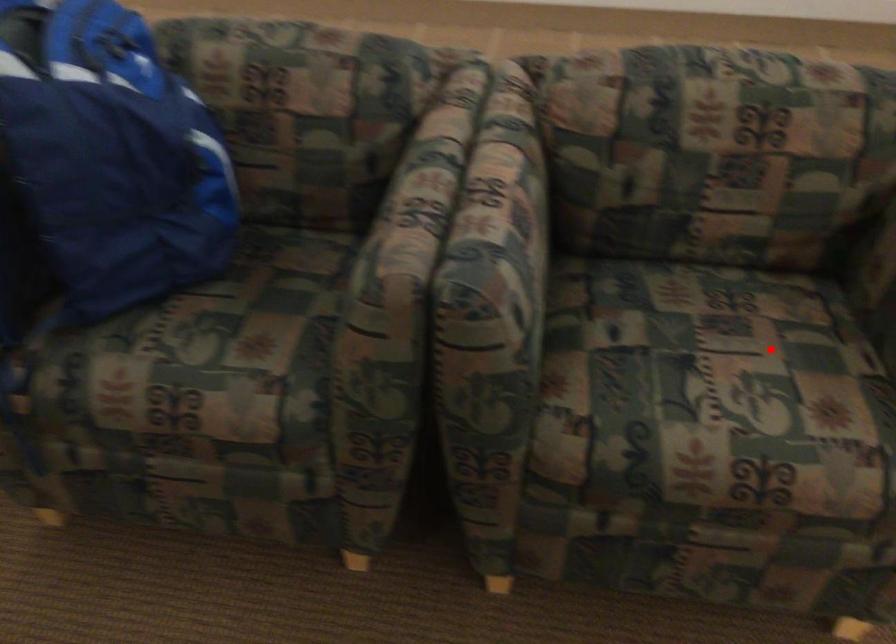
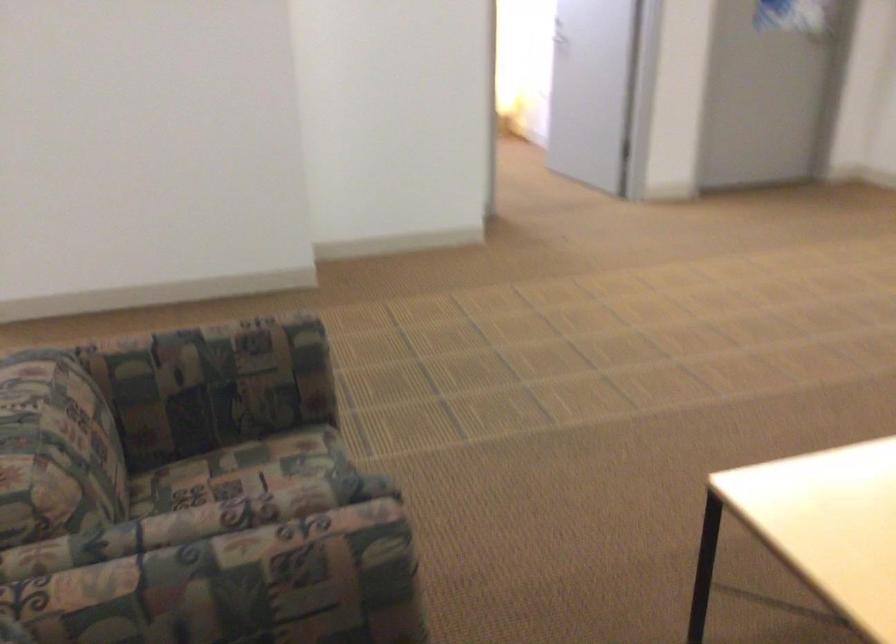
The point at the highlighted location is marked in the first image. Where is the corresponding point in the second image?

(254, 468)